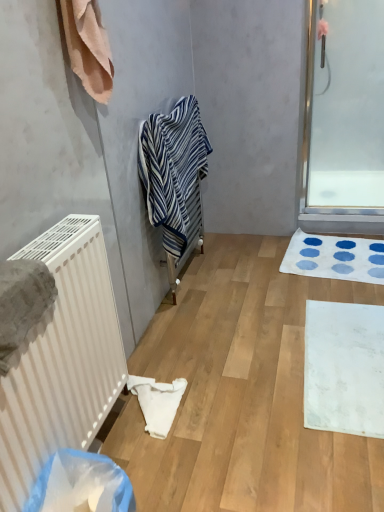
This screenshot has width=384, height=512. Find the location of `blank space situated above white fabric towel at lower center (from a real-world perspective)`. blank space situated above white fabric towel at lower center (from a real-world perspective) is located at coordinates (133, 393).